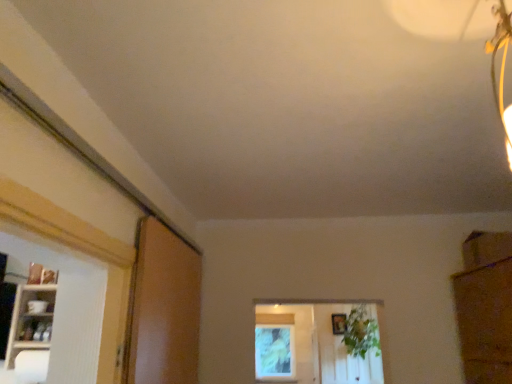
Question: Is point (138, 367) positioned closer to the camera than point (352, 312)?

Choices:
 (A) farther
 (B) closer

Answer: (B)

Question: Is brown matte screen door at left in front of or behind green leafy plant at center in the image?

Choices:
 (A) front
 (B) behind

Answer: (A)

Question: Which of these objects is positioned closest to the brown matte screen door at left?

Choices:
 (A) green leafy plant at center
 (B) white glossy shelf at left
 (C) wooden picture frame at center

Answer: (B)

Question: Which is nearer to the green leafy plant at center?

Choices:
 (A) brown matte screen door at left
 (B) wooden picture frame at center
 (C) white glossy shelf at left

Answer: (B)